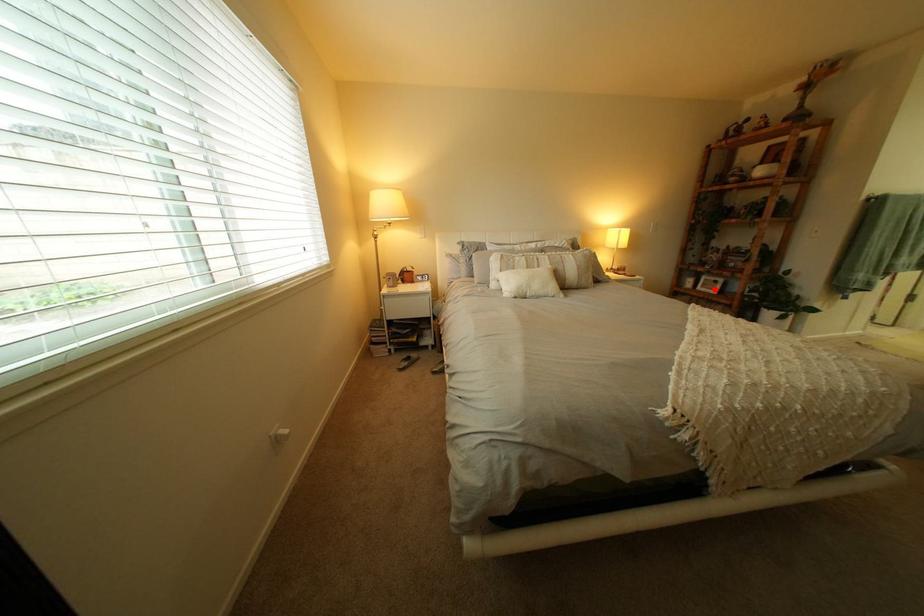
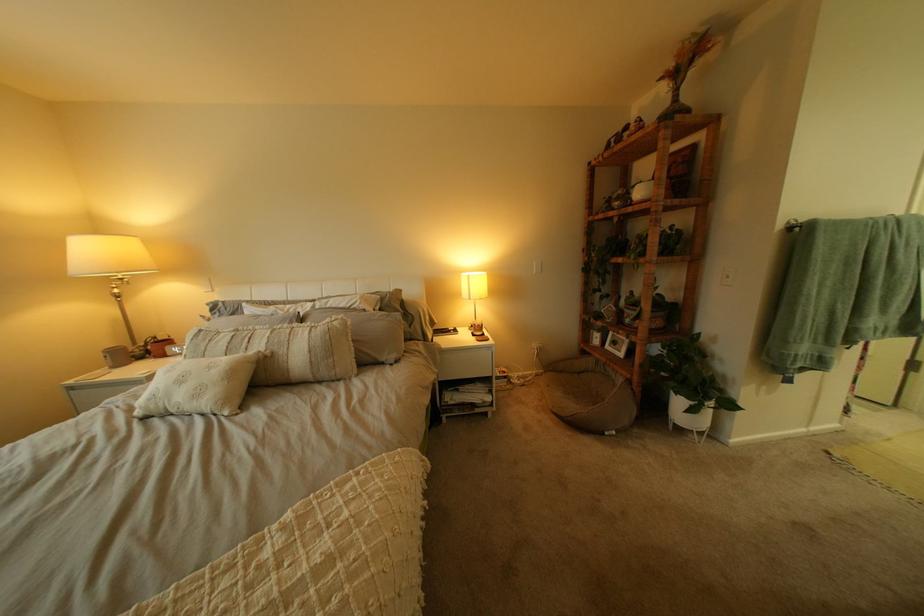
Question: A red point is marked in image1. In image2, is the corresponding 3D point closer to the camera or farther? Reply with the corresponding letter.

Choices:
 (A) The corresponding 3D point is closer.
 (B) The corresponding 3D point is farther.

Answer: (B)